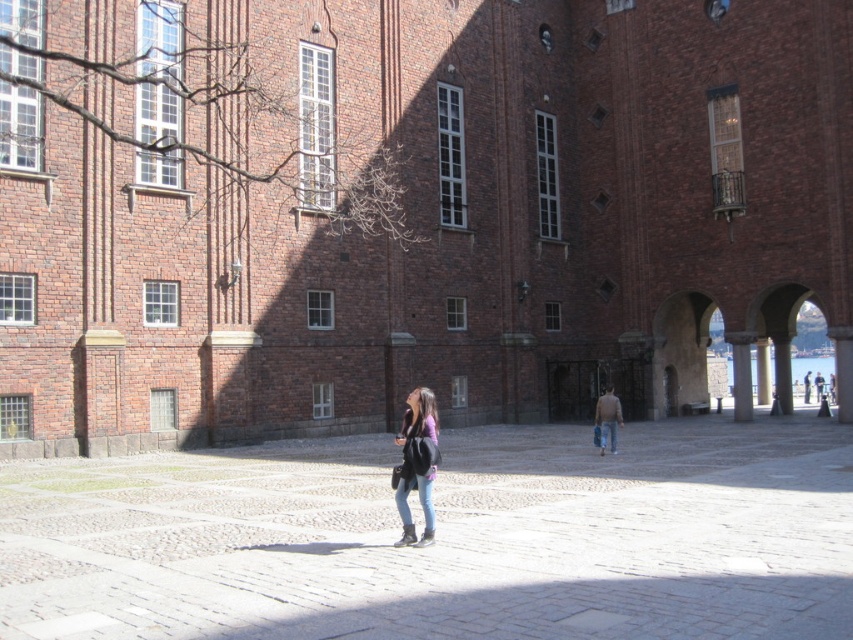
Question: Can you confirm if smooth stone courtyard at center is bigger than light brown sweater at center?

Choices:
 (A) no
 (B) yes

Answer: (B)

Question: Which point is farther from the camera taking this photo?

Choices:
 (A) (849, 556)
 (B) (421, 388)

Answer: (B)

Question: Among these objects, which one is nearest to the camera?

Choices:
 (A) matte black backpack at center
 (B) light brown sweater at center

Answer: (A)

Question: Can you confirm if matte black backpack at center is bigger than denim jacket at center?

Choices:
 (A) no
 (B) yes

Answer: (A)

Question: Estimate the real-world distances between objects in this image. Which object is closer to the smooth stone courtyard at center?

Choices:
 (A) denim jacket at center
 (B) matte black backpack at center
 (C) light brown sweater at center

Answer: (B)

Question: In this image, where is smooth stone courtyard at center located relative to denim jacket at center?

Choices:
 (A) above
 (B) below

Answer: (A)